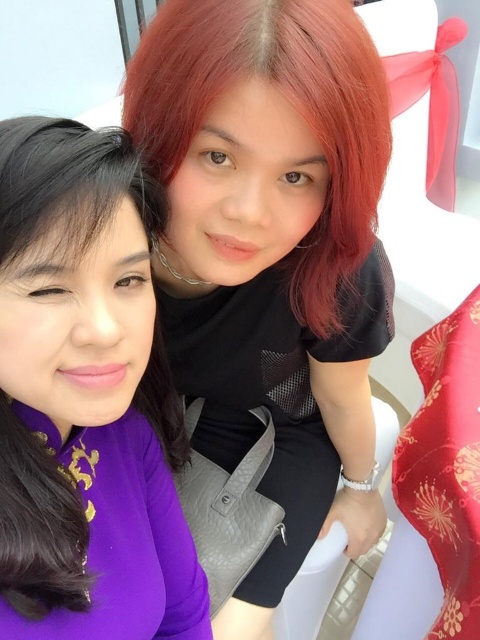
You are taking a photo of two people standing side by side. The person with the shiny red hair at upper center is holding a gray handbag and a white object. The other person, with matte black hair at upper right, is wearing a purple traditional outfit. Which person is positioned to the left of the other?

The matte black hair at upper right is to the left of shiny red hair at upper center, so the person with matte black hair at upper right is positioned to the left of the person with shiny red hair at upper center.

Based on the photo, you are a photographer standing at a distance of 18 inches from the subjects. You want to focus on the matte black hair at upper right. Will you need to adjust your focus to capture it clearly?

The matte black hair at upper right is 17.68 inches from the viewer. Since you are standing 18 inches away, it is slightly farther than your current focus distance. Adjust your focus to ensure clarity.

You are a photographer setting up a tripod to capture the two people in the image. The matte black hair at upper right and the shiny red hair at upper center are standing close to each other. Which person should you adjust the camera height to focus on first to ensure their head is in the center of the frame?

The matte black hair at upper right is much taller than the shiny red hair at upper center, so you should first adjust the camera height to focus on the matte black hair at upper right to ensure their head is centered before adjusting for the shorter person.